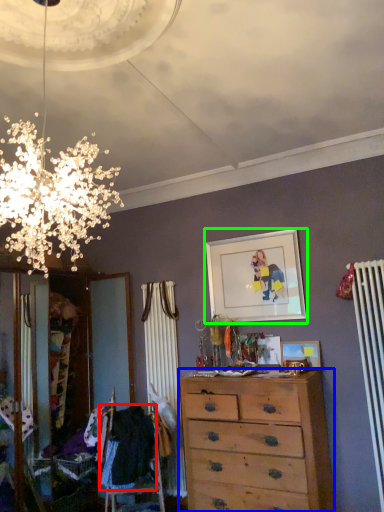
Question: Which object is the farthest from clothing (highlighted by a red box)? Choose among these: chest of drawers (highlighted by a blue box) or picture frame (highlighted by a green box).

Choices:
 (A) chest of drawers
 (B) picture frame

Answer: (B)